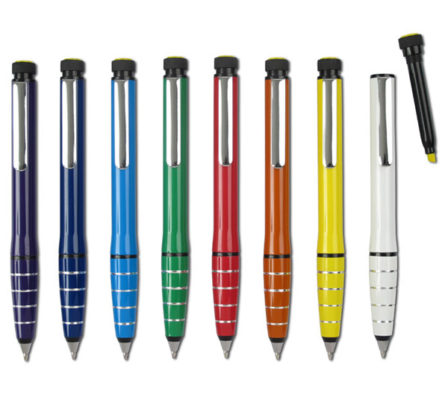
Where is `pens`? pens is located at coordinates (31, 233), (72, 235), (124, 234), (172, 234), (228, 227), (283, 215), (338, 211), (382, 206).